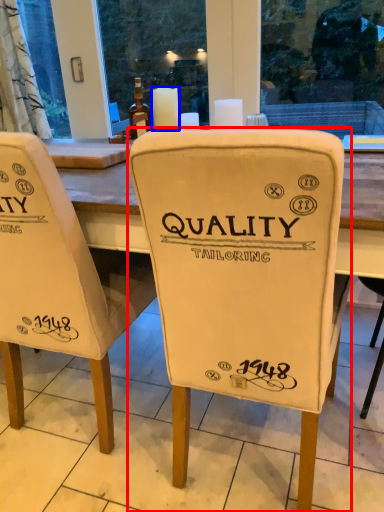
Question: Which object is further to the camera taking this photo, chair (highlighted by a red box) or candle (highlighted by a blue box)?

Choices:
 (A) chair
 (B) candle

Answer: (B)